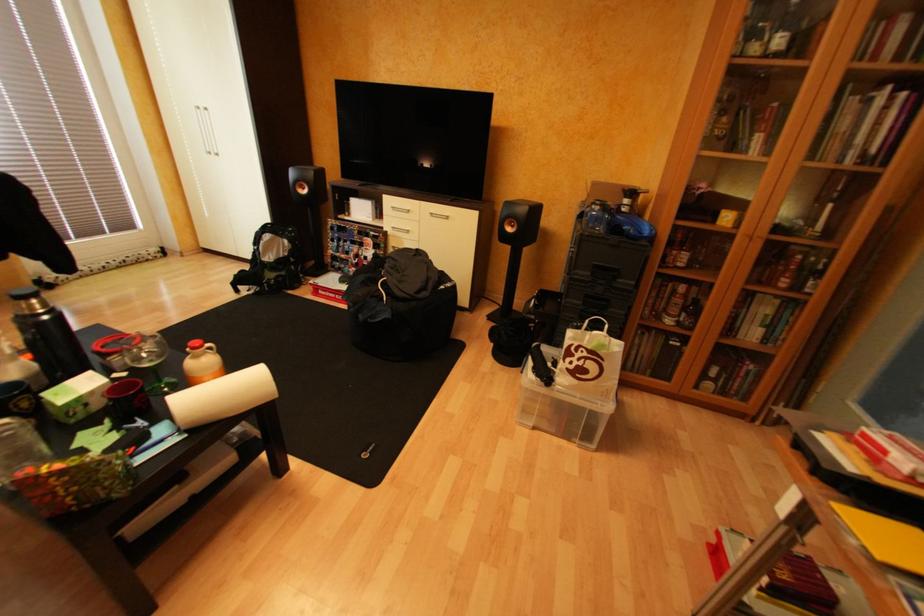
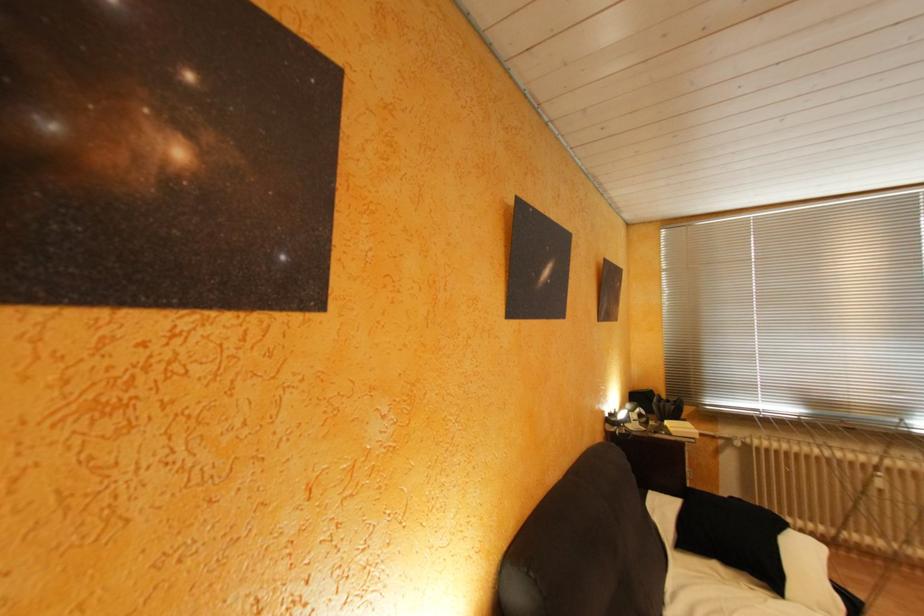
Question: Based on the continuous images, in which direction is the camera rotating? Reply with the corresponding letter.

Choices:
 (A) Left
 (B) Right
 (C) Up
 (D) Down

Answer: (A)